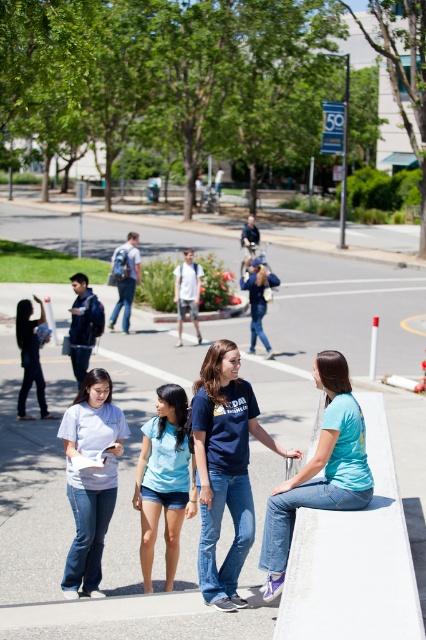
Who is higher up, light blue t-shirt at lower right or white matte t-shirt at lower left?

Positioned higher is light blue t-shirt at lower right.

Can you confirm if light blue t-shirt at lower right is wider than white matte t-shirt at lower left?

Yes.

Identify the location of light blue t-shirt at lower right. (319, 468).

Identify the location of light blue t-shirt at lower right. (319, 468).

Between light blue t-shirt at lower right and blue cotton shirt at center, which one has less height?

With less height is blue cotton shirt at center.

Can you confirm if light blue t-shirt at lower right is taller than blue cotton shirt at center?

Correct, light blue t-shirt at lower right is much taller as blue cotton shirt at center.

Between point (351, 403) and point (160, 456), which one is positioned in front?

Point (351, 403) is in front.

Find the location of a particular element. light blue t-shirt at lower right is located at coordinates (319, 468).

Identify the location of white matte t-shirt at lower left. Image resolution: width=426 pixels, height=640 pixels. (91, 477).

Based on the photo, who is more forward, [88,528] or [42,376]?

Point [88,528] is in front.

Is point (126, 428) closer to viewer compared to point (43, 316)?

Yes, it is in front of point (43, 316).

Identify the location of white matte t-shirt at lower left. (91, 477).